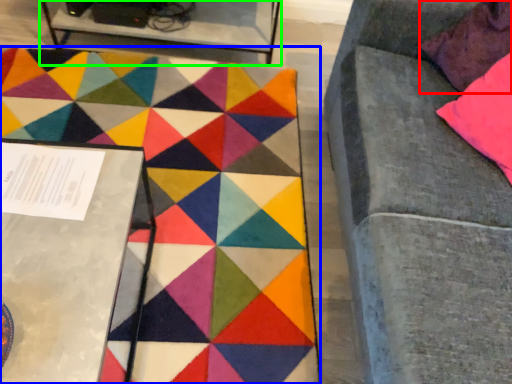
Question: Based on their relative distances, which object is farther from pillow (highlighted by a red box)? Choose from mat (highlighted by a blue box) and table (highlighted by a green box).

Choices:
 (A) mat
 (B) table

Answer: (B)